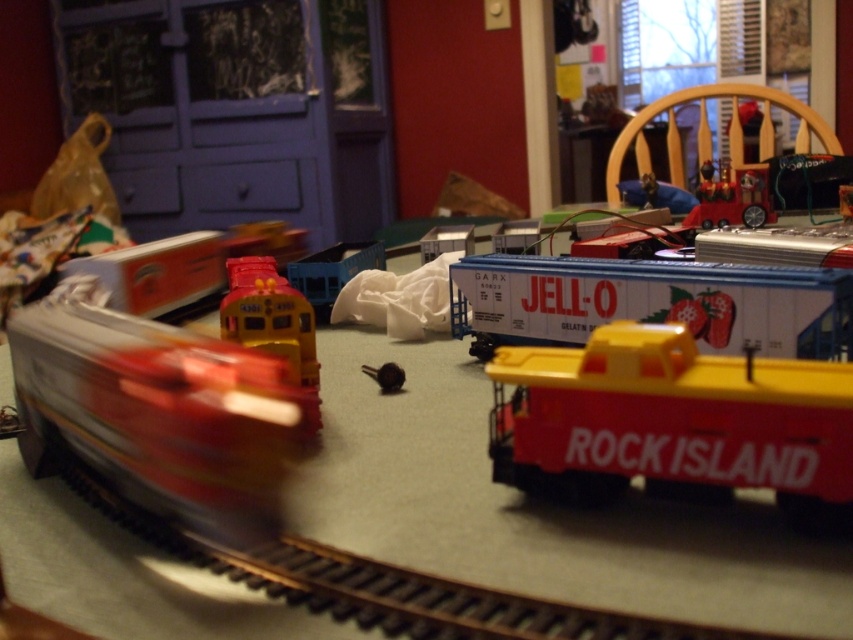
Question: In this image, where is yellow plastic train at center located relative to metallic knob at center?

Choices:
 (A) above
 (B) below

Answer: (A)

Question: Which of these objects is positioned closest to the metallic red train at upper right?

Choices:
 (A) yellow plastic train car at center-right
 (B) yellow plastic train at center

Answer: (B)

Question: Which point appears closest to the camera in this image?

Choices:
 (A) (653, 378)
 (B) (820, 339)
 (C) (767, 192)

Answer: (A)

Question: Which point is closer to the camera?

Choices:
 (A) white plastic train car at center
 (B) metallic knob at center
 (C) yellow plastic train at center

Answer: (C)

Question: Is white plastic train car at center below metallic red train at upper right?

Choices:
 (A) yes
 (B) no

Answer: (A)

Question: Is the position of white plastic train car at center less distant than that of yellow plastic train at center?

Choices:
 (A) no
 (B) yes

Answer: (A)